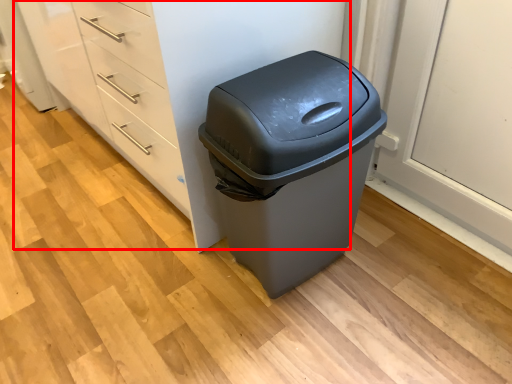
Question: From the image's perspective, considering the relative positions of dresser (annotated by the red box) and waste container in the image provided, where is dresser (annotated by the red box) located with respect to the staircase?

Choices:
 (A) above
 (B) below

Answer: (A)